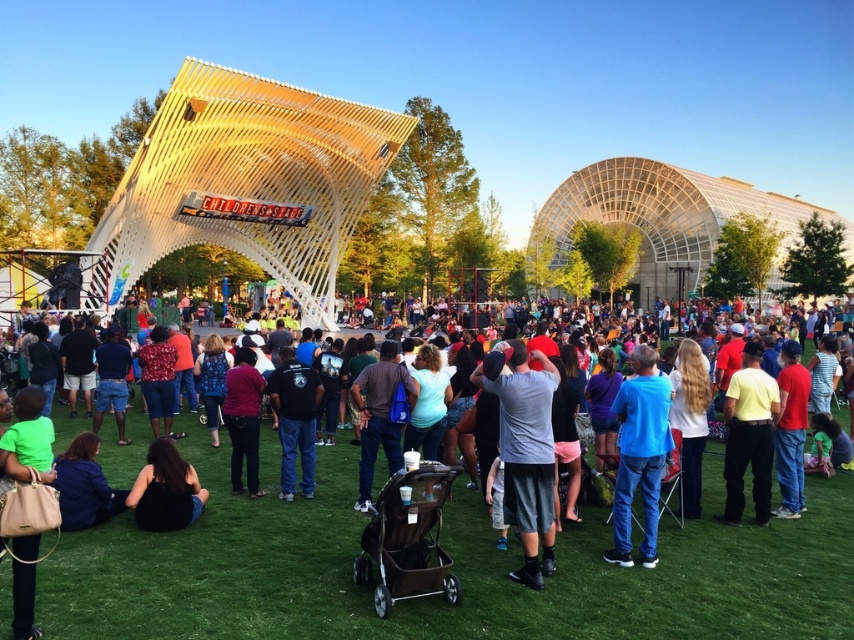
You are standing at the origin point of the coordinate system. You want to move towards the blue cotton shirt at center. Which direction should you move in?

The blue cotton shirt at center is located at point (639, 454), so you should move northeast to reach it.

You are a photographer trying to capture a candid shot of the gray fabric shirt at center and the black fabric at lower center. Since you want to include both in the frame, which direction should you move to ensure both are visible?

You should move to the left to ensure both the gray fabric shirt at center and the black fabric at lower center are visible, as the gray fabric shirt at center is positioned on the right side of black fabric at lower center.